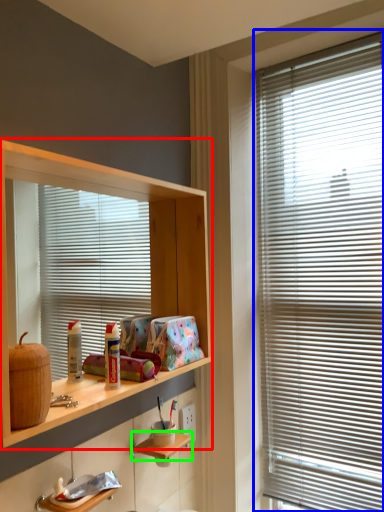
Question: Considering the real-world distances, which object is closest to shelf (highlighted by a red box)? window blind (highlighted by a blue box) or shelf (highlighted by a green box).

Choices:
 (A) window blind
 (B) shelf

Answer: (A)